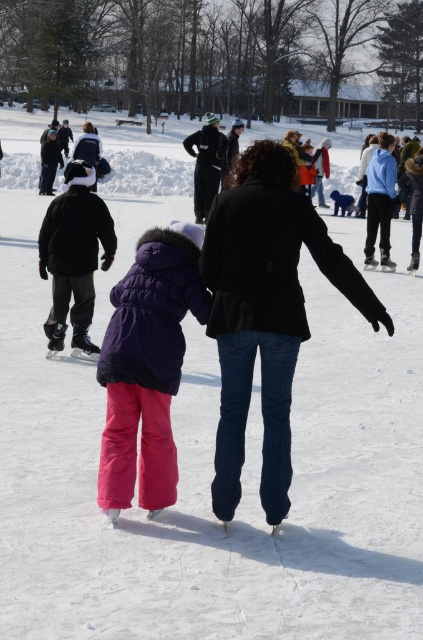
Consider the image. Is black matte coat at center bigger than matte purple jacket at center?

Yes, black matte coat at center is bigger than matte purple jacket at center.

Describe the element at coordinates (266, 312) in the screenshot. I see `black matte coat at center` at that location.

What do you see at coordinates (266, 312) in the screenshot? I see `black matte coat at center` at bounding box center [266, 312].

Where is `black matte coat at center`? The image size is (423, 640). black matte coat at center is located at coordinates (266, 312).